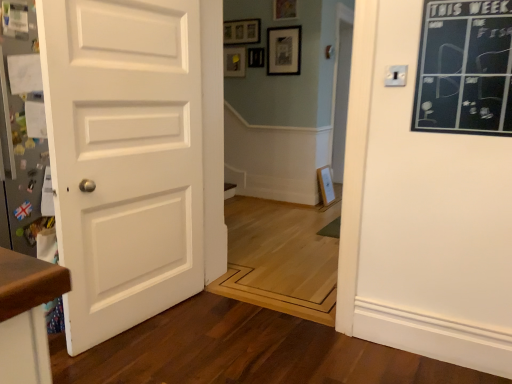
Locate an element on the screen. This screenshot has width=512, height=384. white matte door at left is located at coordinates (124, 157).

This screenshot has width=512, height=384. Identify the location of wooden picture frame at upper center, placed as the first picture frame when sorted from top to bottom. (284, 9).

How much space does wooden picture frame at upper center, which is the 3th picture frame from bottom to top, occupy vertically?

wooden picture frame at upper center, which is the 3th picture frame from bottom to top, is 27.09 centimeters in height.

Find the location of `black chalkboard at upper right`. black chalkboard at upper right is located at coordinates (465, 68).

How much space does matte black picture frame at upper center, the 1th picture frame in the bottom-to-top sequence, occupy horizontally?

1.64 inches.

Locate an element on the screen. This screenshot has height=384, width=512. white matte door at left is located at coordinates (124, 157).

Who is bigger, black chalkboard at upper right or matte black picture frame at upper center, which appears as the third picture frame when viewed from the top?

Bigger between the two is black chalkboard at upper right.

From the image's perspective, is black chalkboard at upper right positioned above or below matte black picture frame at upper center, the 1th picture frame in the bottom-to-top sequence?

black chalkboard at upper right is situated lower than matte black picture frame at upper center, the 1th picture frame in the bottom-to-top sequence, in the image.

Considering the sizes of black chalkboard at upper right and matte black picture frame at upper center, which appears as the third picture frame when viewed from the top, in the image, is black chalkboard at upper right wider or thinner than matte black picture frame at upper center, which appears as the third picture frame when viewed from the top,?

black chalkboard at upper right is wider than matte black picture frame at upper center, which appears as the third picture frame when viewed from the top.

From the image's perspective, is matte black picture frame at upper center, which appears as the third picture frame when viewed from the top, positioned above or below white matte door at left?

From the image's perspective, matte black picture frame at upper center, which appears as the third picture frame when viewed from the top, appears above white matte door at left.

Considering the relative positions of matte black picture frame at upper center, the 1th picture frame in the bottom-to-top sequence, and white matte door at left in the image provided, is matte black picture frame at upper center, the 1th picture frame in the bottom-to-top sequence, to the left or to the right of white matte door at left?

Based on their positions, matte black picture frame at upper center, the 1th picture frame in the bottom-to-top sequence, is located to the right of white matte door at left.

Is matte black picture frame at upper center, the 1th picture frame in the bottom-to-top sequence, taller than white matte door at left?

In fact, matte black picture frame at upper center, the 1th picture frame in the bottom-to-top sequence, may be shorter than white matte door at left.

From a real-world perspective, between matte black picture frame at upper center, the 1th picture frame in the bottom-to-top sequence, and white matte door at left, who is vertically higher?

matte black picture frame at upper center, the 1th picture frame in the bottom-to-top sequence.

Is matte black picture frame at upper center, which appears as the third picture frame when viewed from the top, far from black chalkboard at upper right?

matte black picture frame at upper center, which appears as the third picture frame when viewed from the top, is far away from black chalkboard at upper right.

Based on their positions, is matte black picture frame at upper center, the 1th picture frame in the bottom-to-top sequence, located to the left or right of black chalkboard at upper right?

Based on their positions, matte black picture frame at upper center, the 1th picture frame in the bottom-to-top sequence, is located to the left of black chalkboard at upper right.

Consider the image. Does matte black picture frame at upper center, the 1th picture frame in the bottom-to-top sequence, turn towards black chalkboard at upper right?

No, matte black picture frame at upper center, the 1th picture frame in the bottom-to-top sequence, is not facing towards black chalkboard at upper right.

Which picture frame is the 3rd one when counting from the back of the black chalkboard at upper right? Please provide its 2D coordinates.

[(256, 57)]

From the image's perspective, is matte black picture frame at upper center, which appears as the third picture frame when viewed from the top, on wooden picture frame at upper center, placed as the first picture frame when sorted from top to bottom?

Actually, matte black picture frame at upper center, which appears as the third picture frame when viewed from the top, appears below wooden picture frame at upper center, placed as the first picture frame when sorted from top to bottom, in the image.

Would you say matte black picture frame at upper center, the 1th picture frame in the bottom-to-top sequence, contains wooden picture frame at upper center, which is the 3th picture frame from bottom to top?

Actually, wooden picture frame at upper center, which is the 3th picture frame from bottom to top, is outside matte black picture frame at upper center, the 1th picture frame in the bottom-to-top sequence.

Between point (254, 57) and point (285, 15), which one is positioned in front?

The point (285, 15) is in front.

From a real-world perspective, does matte black picture frame at upper center, which appears as the third picture frame when viewed from the top, sit lower than wooden picture frame at upper center, which is the 3th picture frame from bottom to top?

Yes, from a real-world perspective, matte black picture frame at upper center, which appears as the third picture frame when viewed from the top, is below wooden picture frame at upper center, which is the 3th picture frame from bottom to top.

From the image's perspective, between wooden picture frame at upper center, which is the 3th picture frame from bottom to top, and black chalkboard at upper right, who is located below?

black chalkboard at upper right appears lower in the image.

There is a black chalkboard at upper right. At what (x,y) coordinates should I click in order to perform the action: click on the 3rd picture frame above it (from a real-world perspective). Please return your answer as a coordinate pair (x, y). The height and width of the screenshot is (384, 512). Looking at the image, I should click on (284, 9).

Is wooden picture frame at upper center, placed as the first picture frame when sorted from top to bottom, to the left or to the right of black chalkboard at upper right in the image?

Based on their positions, wooden picture frame at upper center, placed as the first picture frame when sorted from top to bottom, is located to the left of black chalkboard at upper right.

Can you confirm if wooden picture frame at upper center, placed as the first picture frame when sorted from top to bottom, is smaller than black chalkboard at upper right?

Yes, wooden picture frame at upper center, placed as the first picture frame when sorted from top to bottom, is smaller than black chalkboard at upper right.

Is wooden picture frame at upper center, which is the 3th picture frame from bottom to top, looking in the opposite direction of white matte door at left?

wooden picture frame at upper center, which is the 3th picture frame from bottom to top, does not have its back to white matte door at left.

Is white matte door at left inside wooden picture frame at upper center, which is the 3th picture frame from bottom to top?

No, white matte door at left is not surrounded by wooden picture frame at upper center, which is the 3th picture frame from bottom to top.

Does wooden picture frame at upper center, placed as the first picture frame when sorted from top to bottom, touch white matte door at left?

No, wooden picture frame at upper center, placed as the first picture frame when sorted from top to bottom, is not beside white matte door at left.

Is wooden picture frame at upper center, placed as the first picture frame when sorted from top to bottom, bigger than white matte door at left?

Incorrect, wooden picture frame at upper center, placed as the first picture frame when sorted from top to bottom, is not larger than white matte door at left.

In the scene shown: Who is smaller, matte black picture frame at upper center, the 1th picture frame in the bottom-to-top sequence, or matte black picture frame at upper center, placed as the 2th picture frame when sorted from top to bottom?

matte black picture frame at upper center, the 1th picture frame in the bottom-to-top sequence.

Is the position of matte black picture frame at upper center, the 1th picture frame in the bottom-to-top sequence, less distant than that of matte black picture frame at upper center, positioned as the 2th picture frame in bottom-to-top order?

That is False.

Is matte black picture frame at upper center, which appears as the third picture frame when viewed from the top, with matte black picture frame at upper center, positioned as the 2th picture frame in bottom-to-top order?

No, matte black picture frame at upper center, which appears as the third picture frame when viewed from the top, is not making contact with matte black picture frame at upper center, positioned as the 2th picture frame in bottom-to-top order.

Consider the image. Is matte black picture frame at upper center, the 1th picture frame in the bottom-to-top sequence, to the left or to the right of matte black picture frame at upper center, positioned as the 2th picture frame in bottom-to-top order, in the image?

matte black picture frame at upper center, the 1th picture frame in the bottom-to-top sequence, is to the left of matte black picture frame at upper center, positioned as the 2th picture frame in bottom-to-top order.

From a real-world perspective, starting from the black chalkboard at upper right, which picture frame is the 1st one vertically above it? Please provide its 2D coordinates.

[(256, 57)]

Where is `door located below the matte black picture frame at upper center, the 1th picture frame in the bottom-to-top sequence (from the image's perspective)`? The width and height of the screenshot is (512, 384). door located below the matte black picture frame at upper center, the 1th picture frame in the bottom-to-top sequence (from the image's perspective) is located at coordinates (124, 157).

When comparing their distances from matte black picture frame at upper center, positioned as the 2th picture frame in bottom-to-top order, does white matte door at left or wooden picture frame at upper center, placed as the first picture frame when sorted from top to bottom, seem further?

Based on the image, white matte door at left appears to be further to matte black picture frame at upper center, positioned as the 2th picture frame in bottom-to-top order.

From the picture: Considering their positions, is matte black picture frame at upper center, which appears as the third picture frame when viewed from the top, positioned closer to matte black picture frame at upper center, placed as the 2th picture frame when sorted from top to bottom, than wooden picture frame at upper center, placed as the first picture frame when sorted from top to bottom?

matte black picture frame at upper center, which appears as the third picture frame when viewed from the top, lies closer to matte black picture frame at upper center, placed as the 2th picture frame when sorted from top to bottom, than the other object.

Considering their positions, is matte black picture frame at upper center, the 1th picture frame in the bottom-to-top sequence, positioned closer to white matte door at left than black chalkboard at upper right?

black chalkboard at upper right is closer to white matte door at left.

Looking at this image, looking at the image, which one is located closer to matte black picture frame at upper center, which appears as the third picture frame when viewed from the top, white matte door at left or wooden picture frame at upper center, which is the 3th picture frame from bottom to top?

The object closer to matte black picture frame at upper center, which appears as the third picture frame when viewed from the top, is wooden picture frame at upper center, which is the 3th picture frame from bottom to top.

Looking at the image, which one is located closer to wooden picture frame at upper center, placed as the first picture frame when sorted from top to bottom, matte black picture frame at upper center, which appears as the third picture frame when viewed from the top, or black chalkboard at upper right?

matte black picture frame at upper center, which appears as the third picture frame when viewed from the top, is closer to wooden picture frame at upper center, placed as the first picture frame when sorted from top to bottom.

From the image, which object appears to be farther from white matte door at left, black chalkboard at upper right or matte black picture frame at upper center, placed as the 2th picture frame when sorted from top to bottom?

matte black picture frame at upper center, placed as the 2th picture frame when sorted from top to bottom, is positioned further to the anchor white matte door at left.

Considering their positions, is matte black picture frame at upper center, the 1th picture frame in the bottom-to-top sequence, positioned closer to wooden picture frame at upper center, which is the 3th picture frame from bottom to top, than white matte door at left?

Among the two, matte black picture frame at upper center, the 1th picture frame in the bottom-to-top sequence, is located nearer to wooden picture frame at upper center, which is the 3th picture frame from bottom to top.

In the scene shown: Estimate the real-world distances between objects in this image. Which object is closer to black chalkboard at upper right, wooden picture frame at upper center, which is the 3th picture frame from bottom to top, or white matte door at left?

white matte door at left.

Image resolution: width=512 pixels, height=384 pixels. Identify the location of picture frame between wooden picture frame at upper center, placed as the first picture frame when sorted from top to bottom, and matte black picture frame at upper center, the 1th picture frame in the bottom-to-top sequence, from top to bottom. (284, 50).

You are a GUI agent. You are given a task and a screenshot of the screen. Output one action in this format:
    pyautogui.click(x=<x>, y=<y>)
    Task: Click on the picture frame positioned between white matte door at left and matte black picture frame at upper center, placed as the 2th picture frame when sorted from top to bottom, from near to far
    
    Given the screenshot: What is the action you would take?
    pyautogui.click(x=284, y=9)

At what (x,y) coordinates should I click in order to perform the action: click on bulletin board between white matte door at left and matte black picture frame at upper center, placed as the 2th picture frame when sorted from top to bottom, along the z-axis. Please return your answer as a coordinate pair (x, y). This screenshot has height=384, width=512. Looking at the image, I should click on (465, 68).

Where is `bulletin board located between white matte door at left and matte black picture frame at upper center, the 1th picture frame in the bottom-to-top sequence, in the depth direction`? bulletin board located between white matte door at left and matte black picture frame at upper center, the 1th picture frame in the bottom-to-top sequence, in the depth direction is located at coordinates (465, 68).